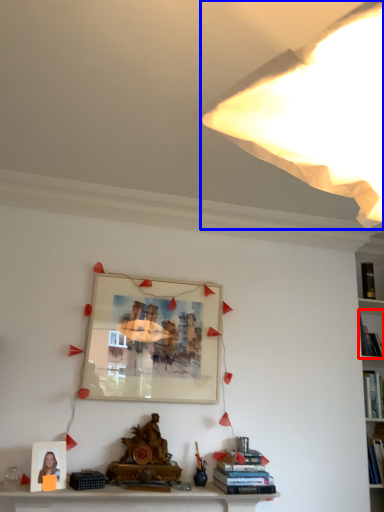
Question: Which point is further to the camera, book (highlighted by a red box) or light (highlighted by a blue box)?

Choices:
 (A) book
 (B) light

Answer: (A)